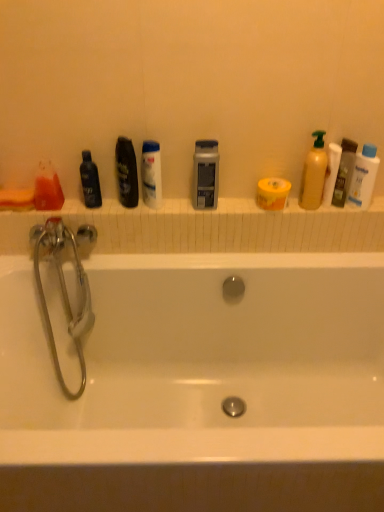
Question: Based on their sizes in the image, would you say translucent orange liquid at left, arranged as the first mouthwash when viewed from the left, is bigger or smaller than white plastic baby lotion at upper right, acting as the second cleaning product starting from the left?

Choices:
 (A) big
 (B) small

Answer: (B)

Question: Considering the positions of translucent orange liquid at left, the 6th mouthwash viewed from the right, and white plastic baby lotion at upper right, acting as the second cleaning product starting from the left, in the image, is translucent orange liquid at left, the 6th mouthwash viewed from the right, taller or shorter than white plastic baby lotion at upper right, acting as the second cleaning product starting from the left,?

Choices:
 (A) tall
 (B) short

Answer: (B)

Question: Considering the real-world distances, which object is farthest from the translucent plastic mouthwash at right, acting as the 6th mouthwash starting from the left?

Choices:
 (A) silver metallic faucet at left
 (B) matte yellow bottle at right, the first cleaning product viewed from the left
 (C) black glossy mouthwash at left, which appears as the fifth mouthwash when viewed from the right
 (D) satin silver mouthwash at center, the second mouthwash viewed from the right
 (E) white plastic baby lotion at upper right, acting as the second cleaning product starting from the left

Answer: (A)

Question: Considering the real-world distances, which object is closest to the black glossy mouthwash at left, which appears as the fifth mouthwash when viewed from the right?

Choices:
 (A) satin silver mouthwash at center, the second mouthwash viewed from the right
 (B) matte yellow bottle at right, acting as the 2th cleaning product starting from the right
 (C) silver metallic faucet at left
 (D) white glossy mouthwash at center, which appears as the fourth mouthwash when viewed from the left
 (E) translucent orange liquid at left, the 6th mouthwash viewed from the right

Answer: (E)